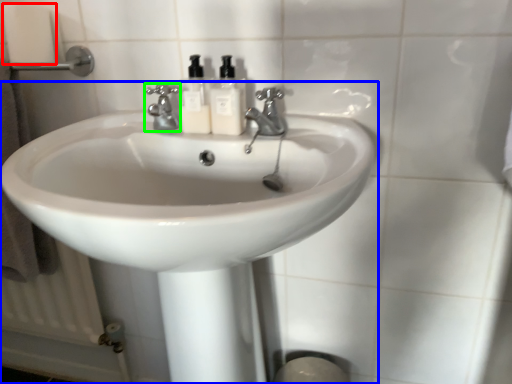
Question: Based on their relative distances, which object is nearer to toilet paper (highlighted by a red box)? Choose from sink (highlighted by a blue box) and tap (highlighted by a green box).

Choices:
 (A) sink
 (B) tap

Answer: (B)